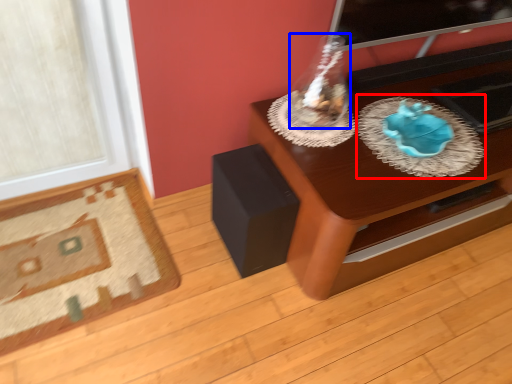
Question: Which object appears farthest to the camera in this image, glass plate (highlighted by a red box) or glass vase (highlighted by a blue box)?

Choices:
 (A) glass plate
 (B) glass vase

Answer: (A)